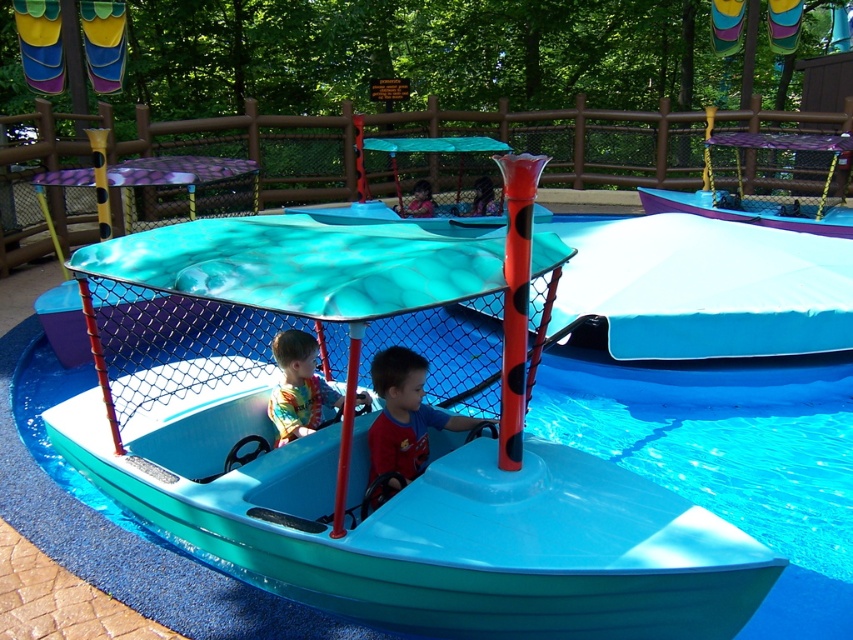
You are a photographer trying to capture both the red shirt at center and the rainbow striped shirt at center in a single shot. Given that your camera can only focus on objects within a 1.2 meter width, will both shirts fit in the frame if they are positioned side by side?

The red shirt at center is larger in size than rainbow striped shirt at center, but the question does not provide information about their combined width. Without knowing the exact dimensions of each shirt, it is impossible to determine if they would fit within the 1.2 meter width constraint.

You are a photographer standing at the back of the boat. You want to take a photo of both the red shirt at center and the rainbow striped shirt at center. Which shirt should you focus on first to ensure both are in frame?

You should focus on the red shirt at center first because it is taller than the rainbow striped shirt at center, ensuring it fits within the frame while the shorter one remains visible.

You are a parent trying to locate your child in the amusement park. You remember your child was wearing a red shirt at center and a rainbow striped shirt at center. Which shirt is closer to you?

The red shirt at center is positioned under rainbow striped shirt at center, so the rainbow striped shirt at center is closer to you.